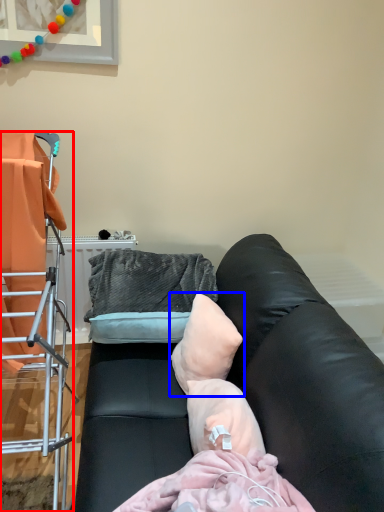
Question: Which point is further to the camera, furniture (highlighted by a red box) or pillow (highlighted by a blue box)?

Choices:
 (A) furniture
 (B) pillow

Answer: (B)